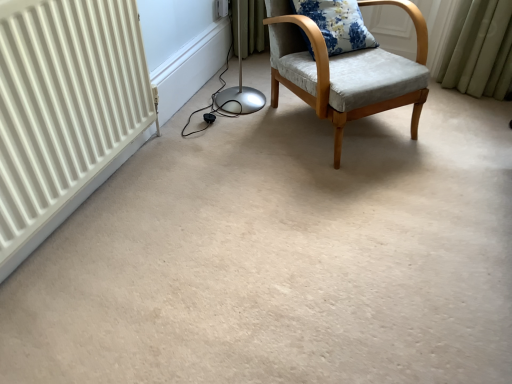
Question: From the image's perspective, is white plastic electric outlet at upper center under floral fabric cushion at upper right?

Choices:
 (A) yes
 (B) no

Answer: (B)

Question: Can you confirm if white plastic electric outlet at upper center is shorter than floral fabric cushion at upper right?

Choices:
 (A) no
 (B) yes

Answer: (B)

Question: From a real-world perspective, does white plastic electric outlet at upper center stand above floral fabric cushion at upper right?

Choices:
 (A) yes
 (B) no

Answer: (B)

Question: Would you say white plastic electric outlet at upper center is a long distance from floral fabric cushion at upper right?

Choices:
 (A) no
 (B) yes

Answer: (A)

Question: From a real-world perspective, is white plastic electric outlet at upper center under floral fabric cushion at upper right?

Choices:
 (A) no
 (B) yes

Answer: (B)

Question: Considering the positions of floral fabric cushion at upper right and white plastic electric outlet at upper center in the image, is floral fabric cushion at upper right taller or shorter than white plastic electric outlet at upper center?

Choices:
 (A) tall
 (B) short

Answer: (A)

Question: Is floral fabric cushion at upper right to the left or to the right of white plastic electric outlet at upper center in the image?

Choices:
 (A) right
 (B) left

Answer: (A)

Question: Relative to white plastic electric outlet at upper center, is floral fabric cushion at upper right in front or behind?

Choices:
 (A) behind
 (B) front

Answer: (B)

Question: Choose the correct answer: Is floral fabric cushion at upper right inside white plastic electric outlet at upper center or outside it?

Choices:
 (A) inside
 (B) outside

Answer: (B)

Question: Do you think light gray fabric chair at center is within white plastic electric outlet at upper center, or outside of it?

Choices:
 (A) inside
 (B) outside

Answer: (B)

Question: From a real-world perspective, is light gray fabric chair at center above or below white plastic electric outlet at upper center?

Choices:
 (A) above
 (B) below

Answer: (A)

Question: Relative to white plastic electric outlet at upper center, is light gray fabric chair at center in front or behind?

Choices:
 (A) front
 (B) behind

Answer: (A)

Question: Is light gray fabric chair at center bigger or smaller than white plastic electric outlet at upper center?

Choices:
 (A) small
 (B) big

Answer: (B)

Question: Considering the positions of point (223, 8) and point (289, 61), is point (223, 8) closer or farther from the camera than point (289, 61)?

Choices:
 (A) farther
 (B) closer

Answer: (A)

Question: Considering the positions of white plastic electric outlet at upper center and light gray fabric chair at center in the image, is white plastic electric outlet at upper center wider or thinner than light gray fabric chair at center?

Choices:
 (A) thin
 (B) wide

Answer: (A)